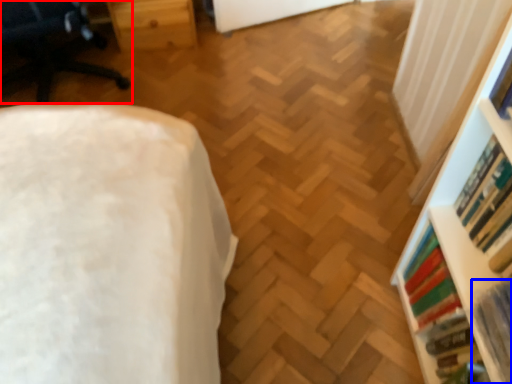
Question: Which object is closer to the camera taking this photo, furniture (highlighted by a red box) or book (highlighted by a blue box)?

Choices:
 (A) furniture
 (B) book

Answer: (B)